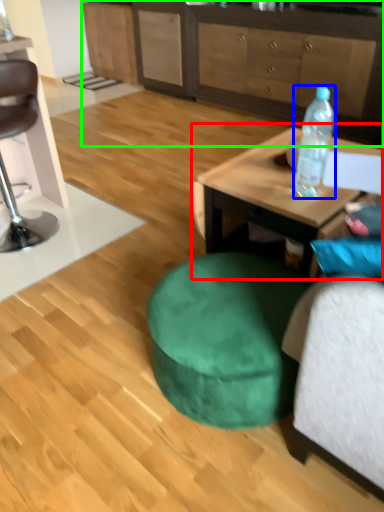
Question: Which object is positioned closest to coffee table (highlighted by a red box)? Select from bottle (highlighted by a blue box) and cabinetry (highlighted by a green box).

Choices:
 (A) bottle
 (B) cabinetry

Answer: (A)